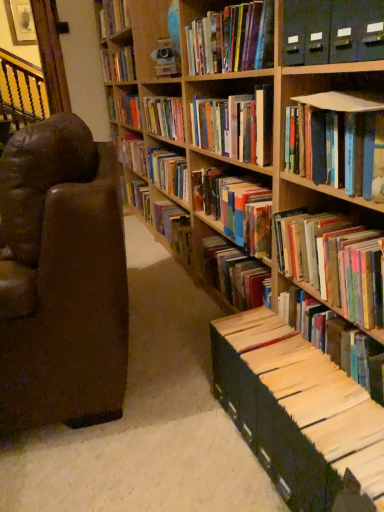
I want to click on white paper at lower right, which is counted as the first book, starting from the bottom, so click(x=336, y=340).

Where is `hardcover book at center, which is counted as the fifth book, starting from the top`? The width and height of the screenshot is (384, 512). hardcover book at center, which is counted as the fifth book, starting from the top is located at coordinates (164, 117).

What do you see at coordinates (343, 142) in the screenshot? Image resolution: width=384 pixels, height=512 pixels. I see `hardcover book at upper right, which is the seventh book in top-to-bottom order` at bounding box center [343, 142].

Describe the element at coordinates (174, 227) in the screenshot. This screenshot has width=384, height=512. I see `hardcover book at center, marked as the third book in a bottom-to-top arrangement` at that location.

How much space does hardcover book at upper center, which ranks as the 6th book in bottom-to-top order, occupy horizontally?

hardcover book at upper center, which ranks as the 6th book in bottom-to-top order, is 22.26 centimeters in width.

I want to click on hardcover book at upper center, which ranks as the 6th book in bottom-to-top order, so click(x=235, y=125).

You are a GUI agent. You are given a task and a screenshot of the screen. Output one action in this format:
    pyautogui.click(x=<x>, y=<y>)
    Task: Click on the hardcover book at center, which ranks as the eighth book in top-to-bottom order
    
    Given the screenshot: What is the action you would take?
    pyautogui.click(x=235, y=208)

In order to click on white paper at lower right, which is counted as the eleventh book, starting from the top in this screenshot , I will do coord(336,340).

From a real-world perspective, does hardcover book at upper center, the 11th book when ordered from bottom to top, sit lower than hardcover books at center, marked as the 2th book in a bottom-to-top arrangement?

No, from a real-world perspective, hardcover book at upper center, the 11th book when ordered from bottom to top, is not under hardcover books at center, marked as the 2th book in a bottom-to-top arrangement.

Considering the relative sizes of hardcover book at upper center, the 1th book positioned from the top, and hardcover books at center, arranged as the tenth book when viewed from the top, in the image provided, is hardcover book at upper center, the 1th book positioned from the top, thinner than hardcover books at center, arranged as the tenth book when viewed from the top,?

Yes, hardcover book at upper center, the 1th book positioned from the top, is thinner than hardcover books at center, arranged as the tenth book when viewed from the top.

Which of these two, hardcover book at upper center, the 1th book positioned from the top, or hardcover books at center, arranged as the tenth book when viewed from the top, stands taller?

With more height is hardcover books at center, arranged as the tenth book when viewed from the top.

Identify the location of the 8th book counting from the right side of the hardcover book at upper center, the 11th book when ordered from bottom to top. Image resolution: width=384 pixels, height=512 pixels. (332, 261).

Is hardcover book at upper center, which ranks as the 6th book in bottom-to-top order, located outside hardcover book at center, which is counted as the ninth book, starting from the top?

Absolutely, hardcover book at upper center, which ranks as the 6th book in bottom-to-top order, is external to hardcover book at center, which is counted as the ninth book, starting from the top.

Does hardcover book at upper center, which ranks as the 6th book in bottom-to-top order, come behind hardcover book at center, which is counted as the ninth book, starting from the top?

No, it is in front of hardcover book at center, which is counted as the ninth book, starting from the top.

Which is nearer, (226,132) or (157,202)?

Point (226,132).

At what (x,y) coordinates should I click in order to perform the action: click on the 6th book positioned below the hardcover book at upper center, the 1th book positioned from the top (from a real-world perspective). Please return your answer as a coordinate pair (x, y). This screenshot has height=512, width=384. Looking at the image, I should click on (343, 142).

Does hardcover book at upper center, the 11th book when ordered from bottom to top, have a larger size compared to hardcover book at upper right, which is the seventh book in top-to-bottom order?

No, hardcover book at upper center, the 11th book when ordered from bottom to top, is not bigger than hardcover book at upper right, which is the seventh book in top-to-bottom order.

Is hardcover book at upper center, the 11th book when ordered from bottom to top, surrounding hardcover book at upper right, which is the seventh book in top-to-bottom order?

No, hardcover book at upper right, which is the seventh book in top-to-bottom order, is not inside hardcover book at upper center, the 11th book when ordered from bottom to top.

Could you tell me if hardcover book at upper center, the 11th book when ordered from bottom to top, is facing hardcover book at center, which is counted as the fifth book, starting from the top?

No.

Which object is further away from the camera, hardcover book at upper center, the 11th book when ordered from bottom to top, or hardcover book at center, the 7th book ordered from the bottom?

hardcover book at upper center, the 11th book when ordered from bottom to top.

Is hardcover book at upper center, the 11th book when ordered from bottom to top, wider than hardcover book at center, which is counted as the fifth book, starting from the top?

Incorrect, the width of hardcover book at upper center, the 11th book when ordered from bottom to top, does not surpass that of hardcover book at center, which is counted as the fifth book, starting from the top.

This screenshot has width=384, height=512. What are the coordinates of `chair behind the hardcover book at upper right, which is the seventh book in top-to-bottom order` in the screenshot? It's located at (61, 278).

Is brown leather chair at left bigger than hardcover book at upper right, which is the seventh book in top-to-bottom order?

Indeed, brown leather chair at left has a larger size compared to hardcover book at upper right, which is the seventh book in top-to-bottom order.

From their relative heights in the image, would you say brown leather chair at left is taller or shorter than hardcover book at upper right, which is the seventh book in top-to-bottom order?

Considering their sizes, brown leather chair at left has more height than hardcover book at upper right, which is the seventh book in top-to-bottom order.

Is brown leather chair at left facing towards hardcover book at upper right, the 5th book when ordered from bottom to top?

No, brown leather chair at left does not turn towards hardcover book at upper right, the 5th book when ordered from bottom to top.

Do you think hardcover book at upper right, which is the seventh book in top-to-bottom order, is within hardcover book at center, which is counted as the ninth book, starting from the top, or outside of it?

hardcover book at upper right, which is the seventh book in top-to-bottom order, is outside hardcover book at center, which is counted as the ninth book, starting from the top.

From the image's perspective, is hardcover book at upper right, which is the seventh book in top-to-bottom order, on hardcover book at center, which is counted as the ninth book, starting from the top?

Yes, from the image's perspective, hardcover book at upper right, which is the seventh book in top-to-bottom order, is on top of hardcover book at center, which is counted as the ninth book, starting from the top.

Visually, is hardcover book at upper right, the 5th book when ordered from bottom to top, positioned to the left or to the right of hardcover book at center, marked as the third book in a bottom-to-top arrangement?

hardcover book at upper right, the 5th book when ordered from bottom to top, is positioned on hardcover book at center, marked as the third book in a bottom-to-top arrangement,'s right side.

Is hardcover book at upper right, the 5th book when ordered from bottom to top, not near hardcover book at center, which is counted as the ninth book, starting from the top?

Yes, hardcover book at upper right, the 5th book when ordered from bottom to top, and hardcover book at center, which is counted as the ninth book, starting from the top, are located far from each other.

What's the angular difference between brown leather chair at left and hardcover book at upper center, arranged as the second book when viewed from the top,'s facing directions?

There is a 10.6-degree angle between the facing directions of brown leather chair at left and hardcover book at upper center, arranged as the second book when viewed from the top.

Is brown leather chair at left at the left side of hardcover book at upper center, the tenth book from the bottom?

In fact, brown leather chair at left is to the right of hardcover book at upper center, the tenth book from the bottom.

Is the position of brown leather chair at left less distant than that of hardcover book at upper center, arranged as the second book when viewed from the top?

Yes, brown leather chair at left is closer to the viewer.

Is brown leather chair at left beside hardcover book at upper center, arranged as the second book when viewed from the top?

No, brown leather chair at left is not with hardcover book at upper center, arranged as the second book when viewed from the top.

Locate an element on the screen. The height and width of the screenshot is (512, 384). book that is the 7th object above the hardcover books at center, marked as the 2th book in a bottom-to-top arrangement (from a real-world perspective) is located at coordinates (113, 17).

Identify the location of the 2nd book counting from the left side of the hardcover book at upper center, which is the 6th book in top-to-bottom order. The image size is (384, 512). (174, 227).

Estimate the real-world distances between objects in this image. Which object is further from hardcover book at upper center, which is the 6th book in top-to-bottom order, matte black file folders at upper right, acting as the 4th book starting from the top, or hardcover book at center, marked as the third book in a bottom-to-top arrangement?

hardcover book at center, marked as the third book in a bottom-to-top arrangement, is further to hardcover book at upper center, which is the 6th book in top-to-bottom order.

Considering their positions, is hardcover book at upper center, the third book when ordered from top to bottom, positioned further to hardcover book at center, placed as the 4th book when sorted from bottom to top, than hardcover book at center, marked as the third book in a bottom-to-top arrangement?

hardcover book at upper center, the third book when ordered from top to bottom, lies further to hardcover book at center, placed as the 4th book when sorted from bottom to top, than the other object.

Which object lies further to the anchor point hardcover book at center, which is counted as the fifth book, starting from the top, hardcover book at upper center, which ranks as the 6th book in bottom-to-top order, or hardcover books at center, arranged as the tenth book when viewed from the top?

hardcover books at center, arranged as the tenth book when viewed from the top, is positioned further to the anchor hardcover book at center, which is counted as the fifth book, starting from the top.

Based on their spatial positions, is hardcover book at upper center, acting as the ninth book starting from the bottom, or hardcover book at center, which ranks as the eighth book in top-to-bottom order, further from hardcover book at upper center, the 1th book positioned from the top?

hardcover book at center, which ranks as the eighth book in top-to-bottom order, is further to hardcover book at upper center, the 1th book positioned from the top.

Looking at the image, which one is located further to white paper at lower right, which is counted as the eleventh book, starting from the top, hardcover book at upper center, which ranks as the 6th book in bottom-to-top order, or hardcover book at center, marked as the third book in a bottom-to-top arrangement?

The object further to white paper at lower right, which is counted as the eleventh book, starting from the top, is hardcover book at center, marked as the third book in a bottom-to-top arrangement.

Estimate the real-world distances between objects in this image. Which object is closer to hardcover book at upper center, the third book when ordered from top to bottom, brown leather chair at left or hardcover book at upper center, arranged as the second book when viewed from the top?

hardcover book at upper center, arranged as the second book when viewed from the top, is positioned closer to the anchor hardcover book at upper center, the third book when ordered from top to bottom.

Based on their spatial positions, is hardcover book at upper center, acting as the ninth book starting from the bottom, or white paper at lower right, which is counted as the eleventh book, starting from the top, further from matte black file folders at upper right, which ranks as the 8th book in bottom-to-top order?

hardcover book at upper center, acting as the ninth book starting from the bottom, is further to matte black file folders at upper right, which ranks as the 8th book in bottom-to-top order.

Consider the image. Estimate the real-world distances between objects in this image. Which object is further from brown leather chair at left, white paper at lower right, which is counted as the eleventh book, starting from the top, or hardcover book at center, which is counted as the ninth book, starting from the top?

hardcover book at center, which is counted as the ninth book, starting from the top, is positioned further to the anchor brown leather chair at left.

Locate an element on the screen. chair positioned between hardcover book at upper right, which is the seventh book in top-to-bottom order, and hardcover book at upper center, the 1th book positioned from the top, from near to far is located at coordinates (61, 278).

This screenshot has height=512, width=384. In order to click on book located between hardcover book at center, placed as the 4th book when sorted from bottom to top, and hardcover book at center, marked as the third book in a bottom-to-top arrangement, in the depth direction in this screenshot , I will do `click(164, 117)`.

This screenshot has height=512, width=384. What are the coordinates of `chair between hardcover books at center, arranged as the tenth book when viewed from the top, and hardcover book at upper center, arranged as the second book when viewed from the top, in the front-back direction` in the screenshot? It's located at [x=61, y=278].

You are a GUI agent. You are given a task and a screenshot of the screen. Output one action in this format:
    pyautogui.click(x=<x>, y=<y>)
    Task: Click on the book that lies between hardcover book at upper center, the 11th book when ordered from bottom to top, and hardcover book at upper center, the third book when ordered from top to bottom, from top to bottom
    This screenshot has width=384, height=512.
    Given the screenshot: What is the action you would take?
    pyautogui.click(x=118, y=64)